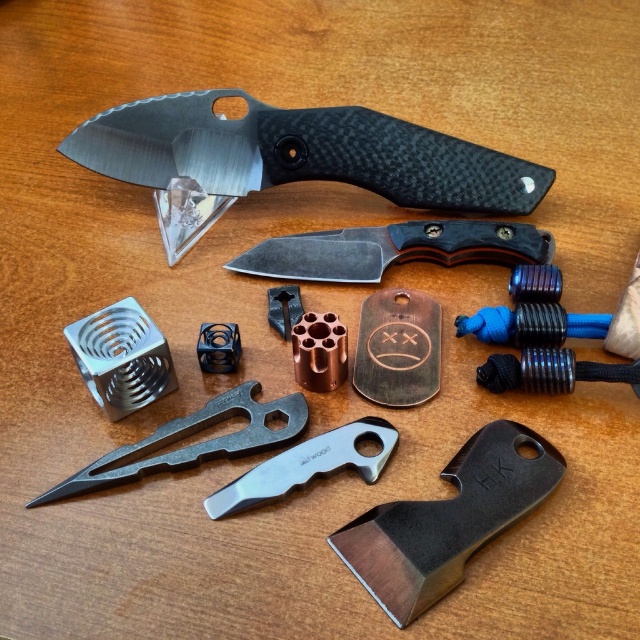
Is matte metal multi-tool at center bigger than silver metallic pocket knife at center?

Yes.

Is matte metal multi-tool at center below silver metallic pocket knife at center?

Actually, matte metal multi-tool at center is above silver metallic pocket knife at center.

Locate an element on the screen. The height and width of the screenshot is (640, 640). matte metal multi-tool at center is located at coordinates pyautogui.click(x=193, y=444).

The image size is (640, 640). I want to click on matte metal multi-tool at center, so click(x=193, y=444).

Looking at this image, who is positioned more to the left, matte black knife at upper center or dark gray metal knife at center?

Positioned to the left is matte black knife at upper center.

Can you confirm if matte black knife at upper center is thinner than dark gray metal knife at center?

No, matte black knife at upper center is not thinner than dark gray metal knife at center.

Who is more forward, (272, 125) or (333, 275)?

Point (333, 275) is more forward.

Image resolution: width=640 pixels, height=640 pixels. I want to click on matte black knife at upper center, so click(291, 157).

Does point (456, 502) lie behind point (168, 429)?

No.

Can you confirm if stainless steel hatchet at center is taller than matte metal multi-tool at center?

Yes, stainless steel hatchet at center is taller than matte metal multi-tool at center.

Who is more forward, (492, 452) or (138, 442)?

Point (492, 452) is in front.

Image resolution: width=640 pixels, height=640 pixels. In order to click on stainless steel hatchet at center in this screenshot , I will do `click(448, 518)`.